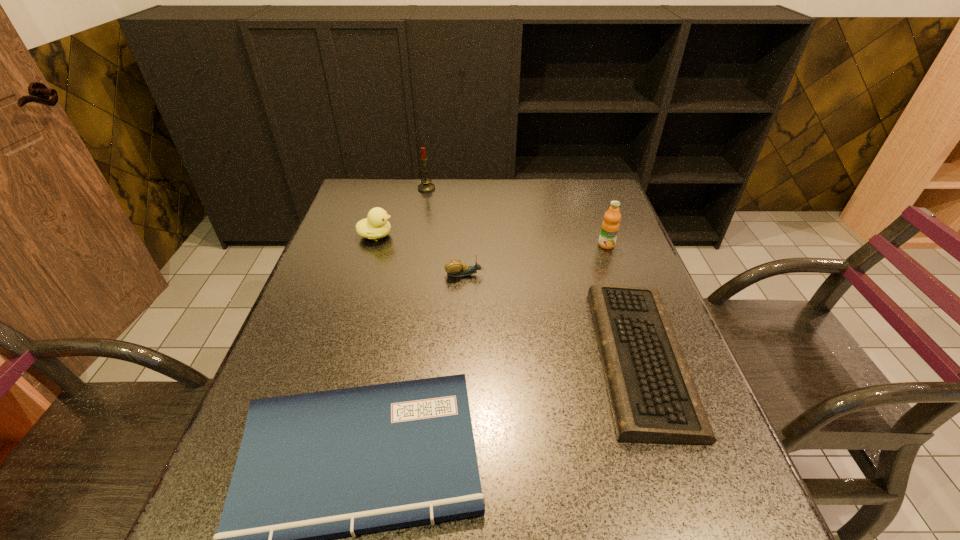
Locate an element on the screen. free region that satisfies the following two spatial constraints: 1. on the label of the orange juice; 2. on the front-facing side of the fourth farthest object is located at coordinates (616, 274).